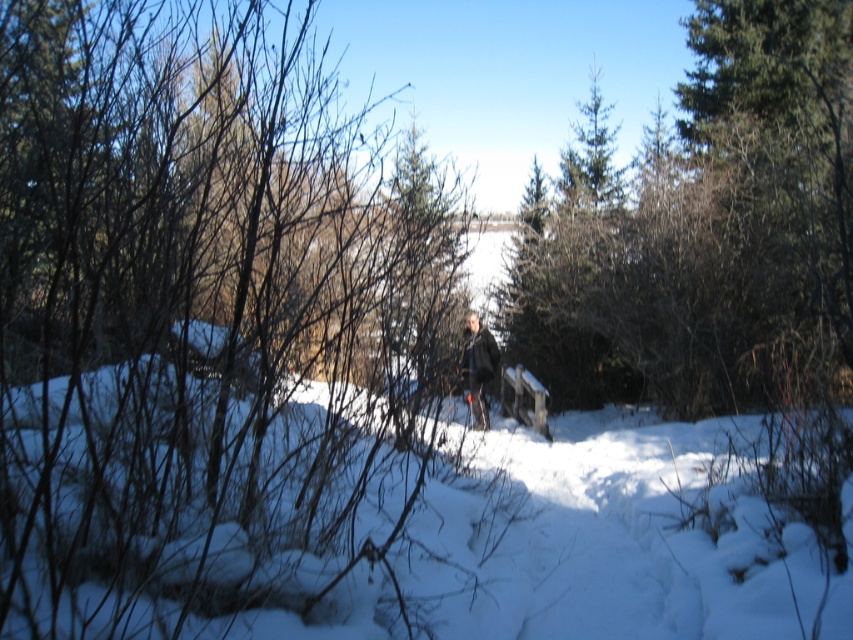
You are a hiker who wants to take a photo of the green leafy tree at center and the dark gray jacket at center. Which object should you focus on first if you want to capture both in the same frame without moving the camera?

The green leafy tree at center is not as tall as the dark gray jacket at center, so you should focus on the dark gray jacket at center first to ensure both are in focus.